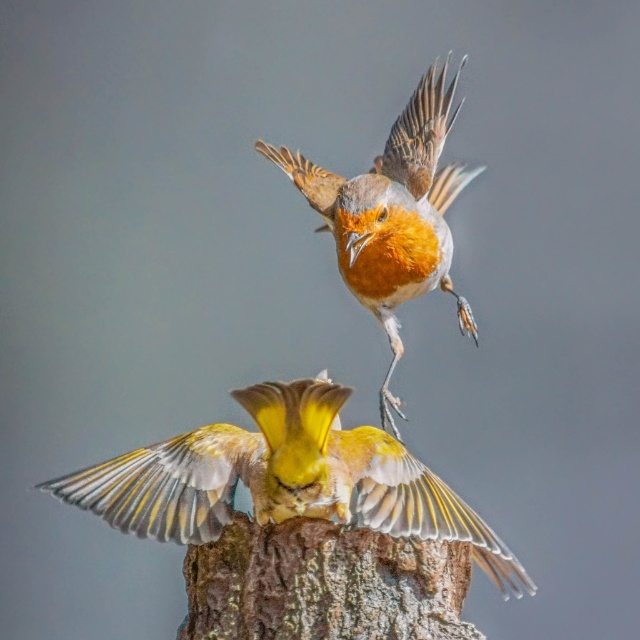
Question: Which object is closer to the camera taking this photo?

Choices:
 (A) bright orange feathers at center
 (B) yellow matte bird at center
 (C) brown rough tree trunk at center

Answer: (B)

Question: Which point is closer to the camera?

Choices:
 (A) (348, 440)
 (B) (396, 186)

Answer: (A)

Question: Can you confirm if yellow matte bird at center is smaller than brown rough tree trunk at center?

Choices:
 (A) yes
 (B) no

Answer: (B)

Question: Does yellow matte bird at center have a greater width compared to bright orange feathers at center?

Choices:
 (A) yes
 (B) no

Answer: (A)

Question: Does brown rough tree trunk at center come in front of bright orange feathers at center?

Choices:
 (A) yes
 (B) no

Answer: (A)

Question: Which point is closer to the camera taking this photo?

Choices:
 (A) [275, 563]
 (B) [451, 284]
 (C) [218, 486]

Answer: (A)